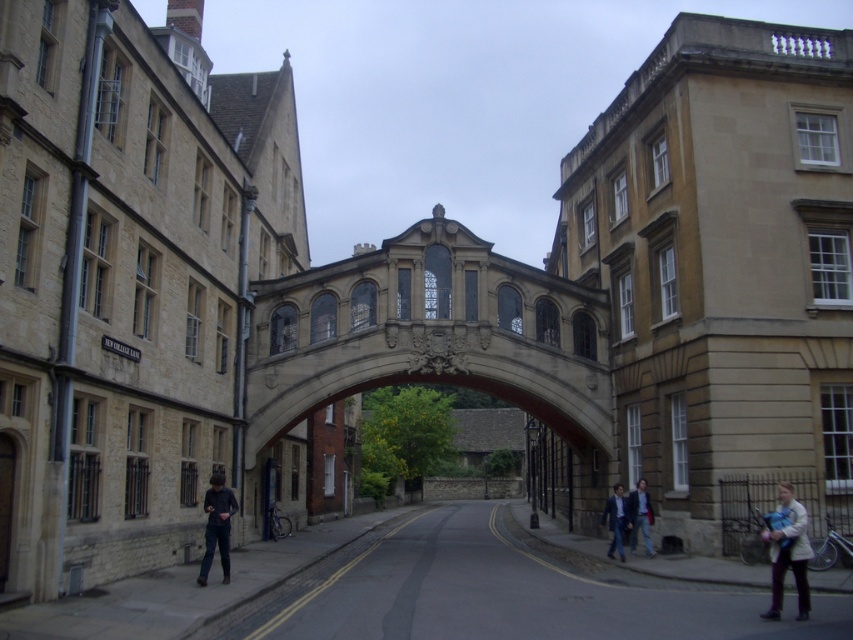
Does stone arch bridge at center have a greater height compared to light blue denim jacket at lower right?

Indeed, stone arch bridge at center has a greater height compared to light blue denim jacket at lower right.

In the scene shown: Can you confirm if stone arch bridge at center is wider than light blue denim jacket at lower right?

Yes.

Find the location of a particular element. Image resolution: width=853 pixels, height=640 pixels. stone arch bridge at center is located at coordinates (431, 337).

Identify the location of stone arch bridge at center. (431, 337).

Is point (212, 636) farther from camera compared to point (607, 509)?

No, it is not.

Is smooth stone alley at center positioned behind dark blue jeans at lower right?

No, it is in front of dark blue jeans at lower right.

Between point (360, 560) and point (625, 508), which one is positioned in front?

Point (625, 508)

Identify the location of smooth stone alley at center. This screenshot has width=853, height=640. (503, 592).

Can you confirm if white wool coat at lower right is bigger than dark blue jeans at lower right?

Yes.

Who is more forward, (x=799, y=611) or (x=614, y=483)?

Positioned in front is point (x=799, y=611).

The image size is (853, 640). In order to click on white wool coat at lower right in this screenshot , I will do `click(788, 554)`.